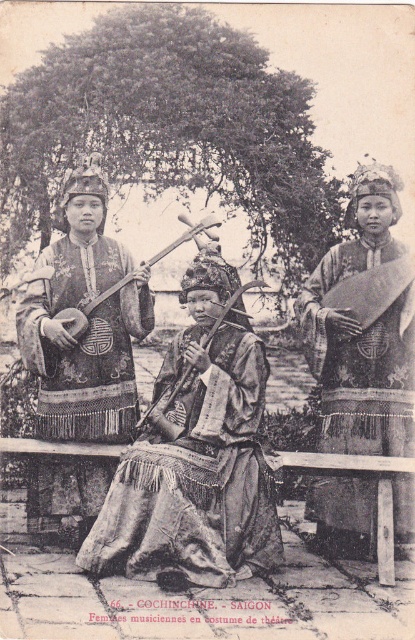
Question: Where is silky dark brown robe at center located in relation to silky brocade robe at right in the image?

Choices:
 (A) above
 (B) below

Answer: (B)

Question: Which object appears farthest from the camera in this image?

Choices:
 (A) silky brocade robe at center
 (B) silky brocade robe at right
 (C) silky dark brown robe at center

Answer: (C)

Question: Which of these objects is positioned farthest from the silky brocade robe at right?

Choices:
 (A) silky brocade robe at center
 (B) silky dark brown robe at center
 (C) wooden carved lute at center

Answer: (B)

Question: Does silky brocade robe at center appear under silky brocade robe at right?

Choices:
 (A) no
 (B) yes

Answer: (B)

Question: Is silky dark brown robe at center below wooden carved lute at center?

Choices:
 (A) yes
 (B) no

Answer: (A)

Question: Considering the real-world distances, which object is closest to the silky dark brown robe at center?

Choices:
 (A) wooden carved lute at center
 (B) silky brocade robe at center

Answer: (B)